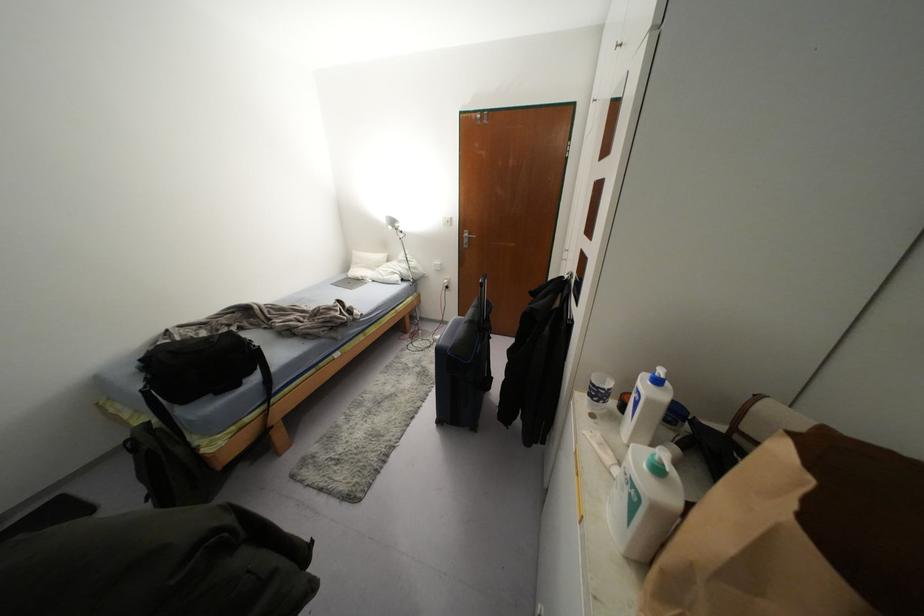
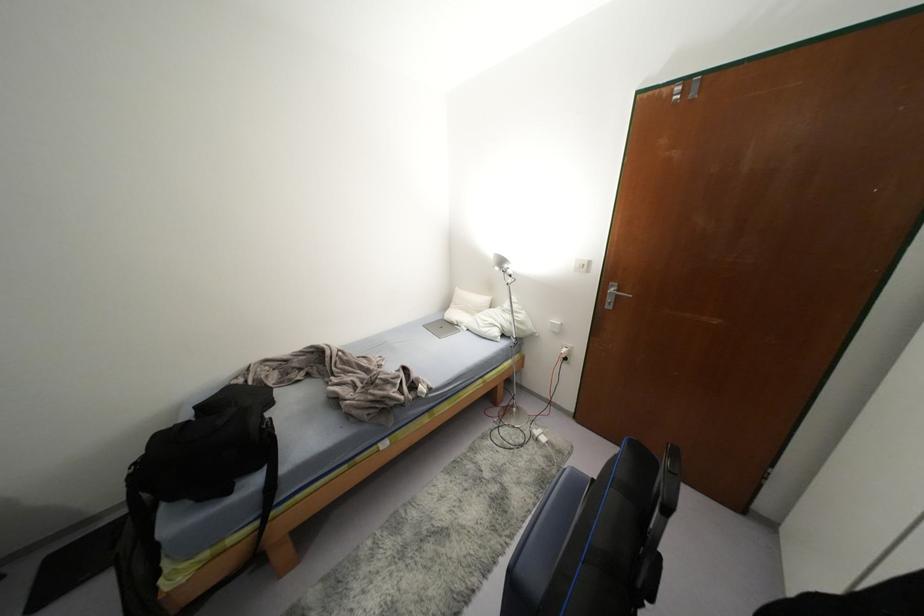
Question: Which direction would the cameraman need to move to produce the second image? Reply with the corresponding letter.

Choices:
 (A) Left
 (B) Right
 (C) Forward
 (D) Backward

Answer: (C)